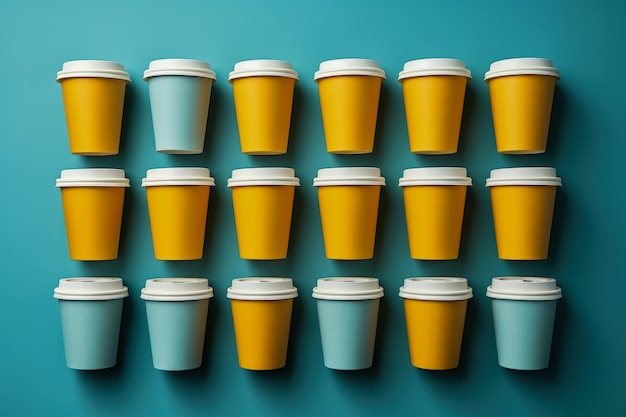
Image resolution: width=626 pixels, height=417 pixels. What are the coordinates of `cups in the row with only one color of cup` in the screenshot? It's located at (95, 216), (178, 213), (264, 216), (350, 218), (438, 217), (513, 214).